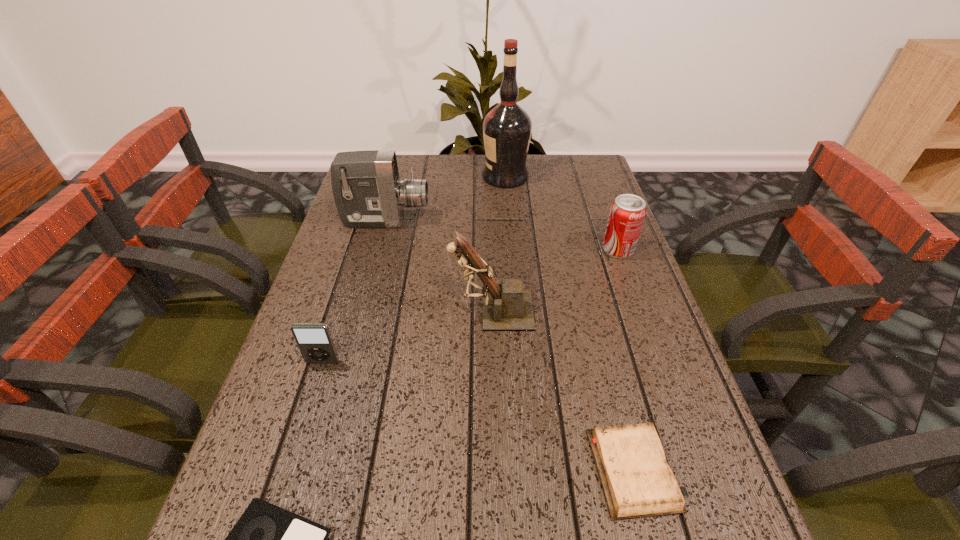
This screenshot has height=540, width=960. In order to click on the tallest object in this screenshot , I will do `click(507, 128)`.

You are a GUI agent. You are given a task and a screenshot of the screen. Output one action in this format:
    pyautogui.click(x=<x>, y=<y>)
    Task: Click on the farthest object
    This screenshot has width=960, height=540.
    Given the screenshot: What is the action you would take?
    pyautogui.click(x=507, y=128)

Identify the location of the fourth nearest object. This screenshot has width=960, height=540. (506, 307).

The width and height of the screenshot is (960, 540). I want to click on camcorder, so click(368, 193).

Where is `the fifth nearest object`? the fifth nearest object is located at coordinates 627,213.

Find the location of a particular element. the fourth shortest object is located at coordinates (627, 213).

You are a GUI agent. You are given a task and a screenshot of the screen. Output one action in this format:
    pyautogui.click(x=<x>, y=<y>)
    Task: Click on the fifth tallest object
    
    Given the screenshot: What is the action you would take?
    click(315, 343)

Where is `the third nearest object`? This screenshot has height=540, width=960. the third nearest object is located at coordinates (315, 343).

Find the location of a particular element. This screenshot has width=960, height=540. the sixth tallest object is located at coordinates tap(637, 481).

The width and height of the screenshot is (960, 540). Identify the location of free spot located 0.220m on the surface of the farthest object. (414, 177).